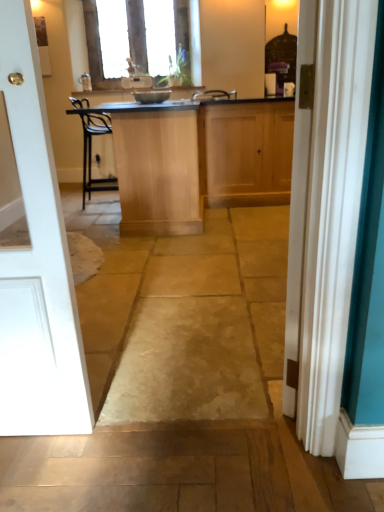
Where is `free point in front of wooden cabinet at center, marked as the 2th cabinetry in a left-to-right arrangement`? free point in front of wooden cabinet at center, marked as the 2th cabinetry in a left-to-right arrangement is located at coordinates (245, 215).